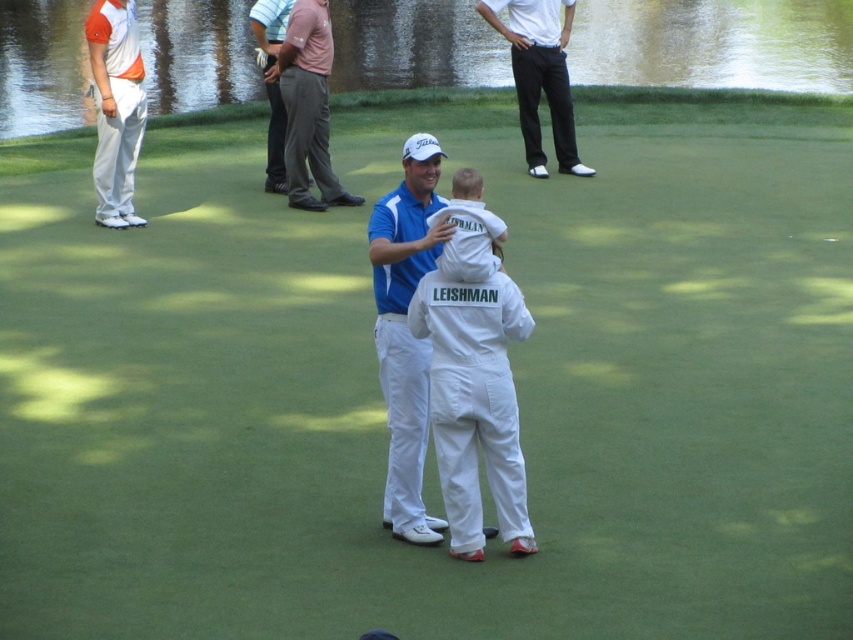
Who is more distant from viewer, (454, 445) or (527, 109)?

The point (527, 109) is behind.

Locate an element on the screen. This screenshot has width=853, height=640. white matte jumpsuit at center is located at coordinates (474, 403).

Locate an element on the screen. white matte jumpsuit at center is located at coordinates (474, 403).

Can you confirm if blue smooth shirt at center is wider than dark gray pants at upper center?

Incorrect, blue smooth shirt at center's width does not surpass dark gray pants at upper center's.

Consider the image. Can you confirm if blue smooth shirt at center is positioned below dark gray pants at upper center?

Yes, blue smooth shirt at center is below dark gray pants at upper center.

Is point (408, 150) positioned before point (561, 147)?

Yes, point (408, 150) is in front of point (561, 147).

Locate an element on the screen. blue smooth shirt at center is located at coordinates pyautogui.click(x=405, y=332).

From the picture: Is orange and white striped polo shirt at upper left taller than pink fabric pants at upper center?

Yes.

Which is behind, point (109, 172) or point (315, 29)?

The point (315, 29) is behind.

The image size is (853, 640). Describe the element at coordinates (115, 108) in the screenshot. I see `orange and white striped polo shirt at upper left` at that location.

Find the location of a particular element. orange and white striped polo shirt at upper left is located at coordinates (115, 108).